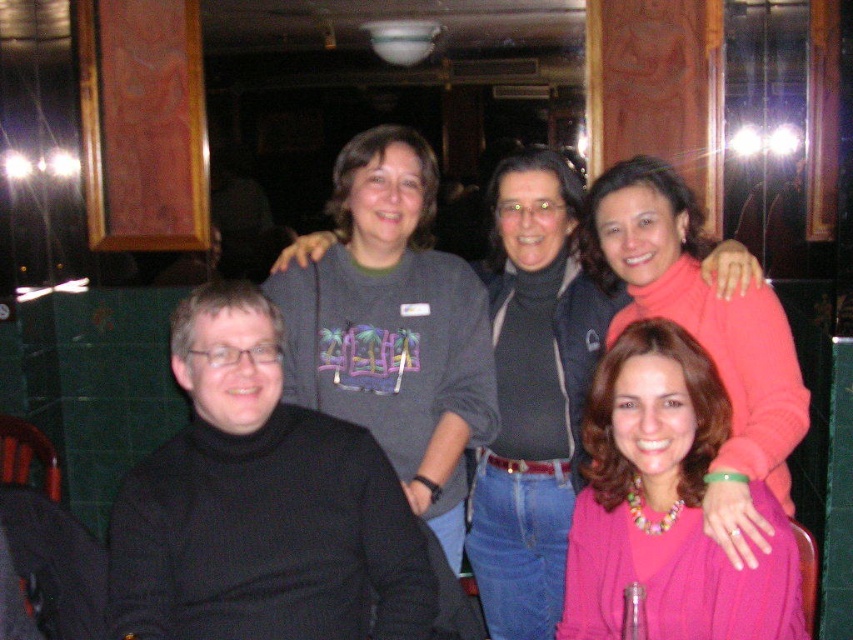
Consider the image. Does black turtleneck sweater at left lie behind pink matte sweater at center?

Yes, it is behind pink matte sweater at center.

Can you confirm if black turtleneck sweater at left is wider than pink matte sweater at center?

Yes, black turtleneck sweater at left is wider than pink matte sweater at center.

Measure the distance between point [149,544] and camera.

5.22 feet

Where is `black turtleneck sweater at left`? The height and width of the screenshot is (640, 853). black turtleneck sweater at left is located at coordinates (262, 506).

Who is taller, pink matte sweater at center or pink matte sweater at upper right?

With more height is pink matte sweater at upper right.

Can you confirm if pink matte sweater at center is bigger than pink matte sweater at upper right?

Incorrect, pink matte sweater at center is not larger than pink matte sweater at upper right.

Locate an element on the screen. pink matte sweater at center is located at coordinates (666, 504).

Who is taller, black turtleneck sweater at left or pink matte sweater at upper right?

pink matte sweater at upper right is taller.

Locate an element on the screen. The image size is (853, 640). black turtleneck sweater at left is located at coordinates (262, 506).